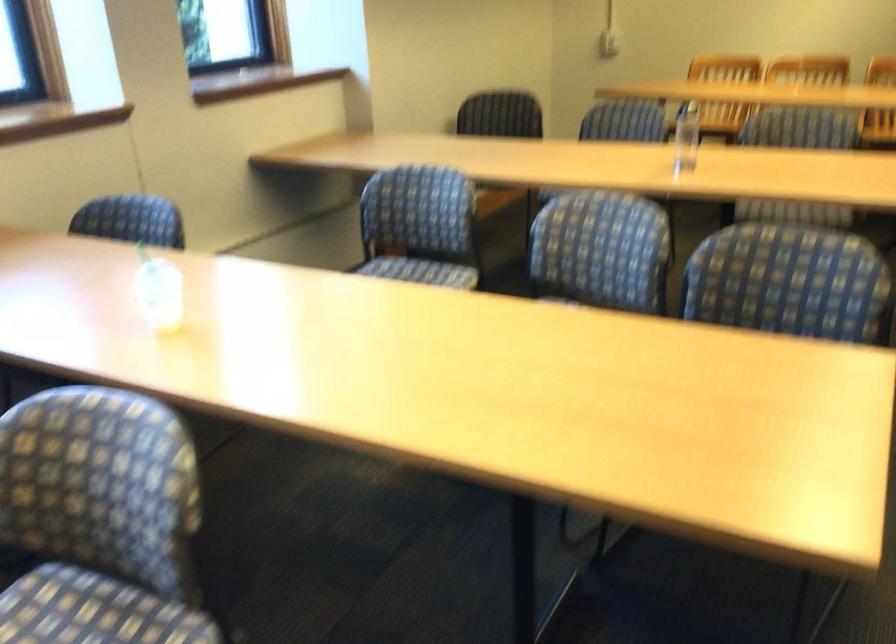
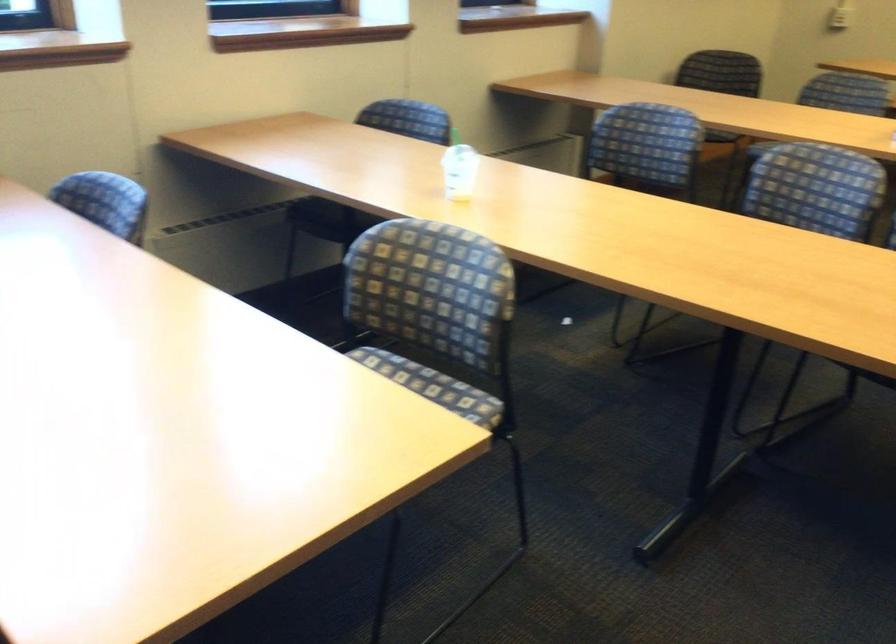
Question: The images are taken continuously from a first-person perspective. In which direction is your viewpoint rotating?

Choices:
 (A) Left
 (B) Right
 (C) Up
 (D) Down

Answer: (A)